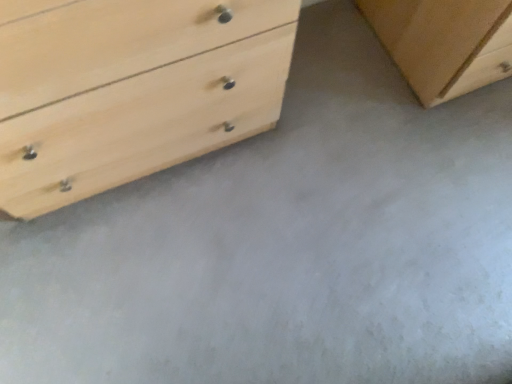
Describe the element at coordinates (132, 91) in the screenshot. I see `natural wood chest of drawers at left` at that location.

This screenshot has width=512, height=384. I want to click on natural wood chest of drawers at left, so click(x=132, y=91).

Identify the location of natural wood chest of drawers at left. (132, 91).